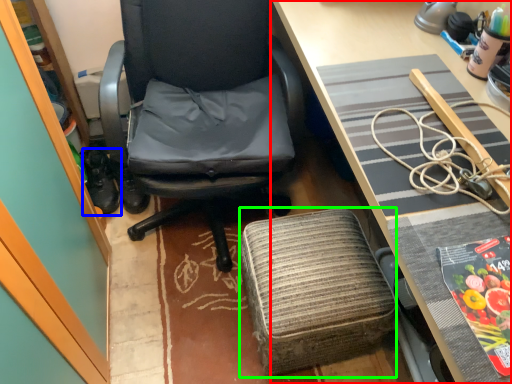
Question: Which object is positioned farthest from desk (highlighted by a red box)? Select from footwear (highlighted by a blue box) and stool (highlighted by a green box).

Choices:
 (A) footwear
 (B) stool

Answer: (A)